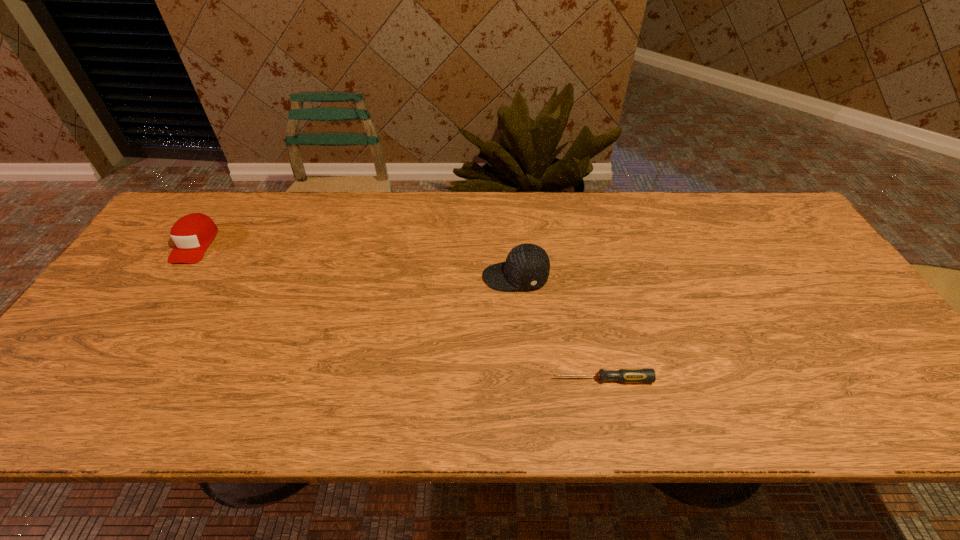
Find the location of `blank region between the screwdriver and the tallest object`. blank region between the screwdriver and the tallest object is located at coordinates (559, 328).

Choose which object is the nearest neighbor to the right baseball cap. Please provide its 2D coordinates. Your answer should be formatted as a tuple, i.e. [(x, y)], where the tuple contains the x and y coordinates of a point satisfying the conditions above.

[(647, 375)]

Choose which object is the nearest neighbor to the shortest object. Please provide its 2D coordinates. Your answer should be formatted as a tuple, i.e. [(x, y)], where the tuple contains the x and y coordinates of a point satisfying the conditions above.

[(527, 266)]